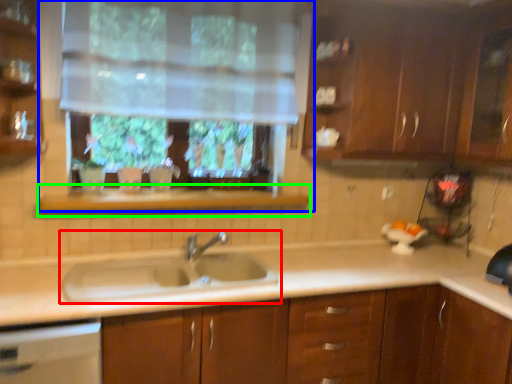
Question: Which is nearer to the sink (highlighted by a red box)? window (highlighted by a blue box) or window sill (highlighted by a green box).

Choices:
 (A) window
 (B) window sill

Answer: (B)